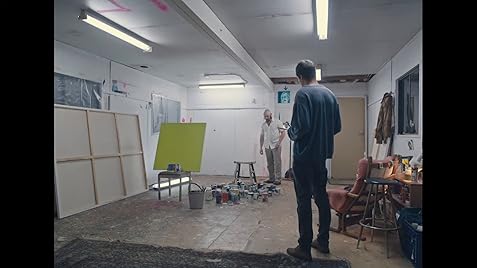
You are a GUI agent. You are given a task and a screenshot of the screen. Output one action in this format:
    pyautogui.click(x=<x>, y=<y>)
    Task: Click on the floor
    This screenshot has height=268, width=477.
    Given the screenshot: What is the action you would take?
    pyautogui.click(x=267, y=223)